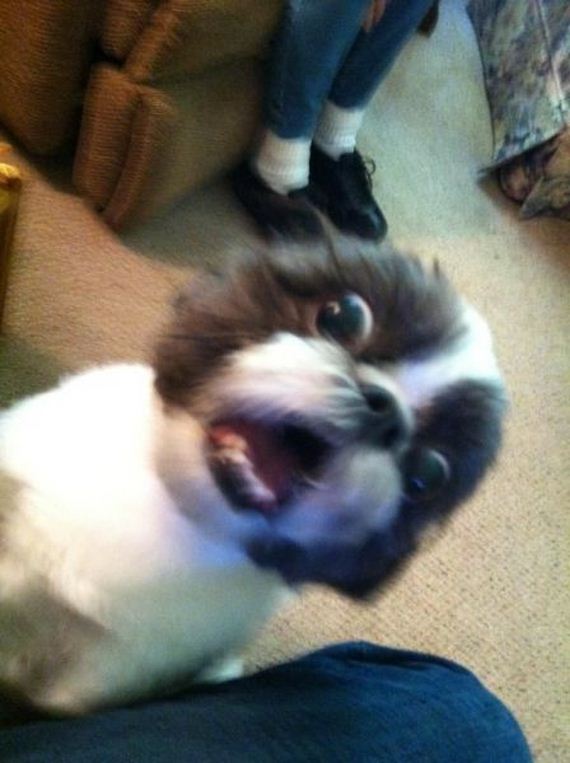
This screenshot has height=763, width=570. I want to click on light brown carpet, so click(x=488, y=644).